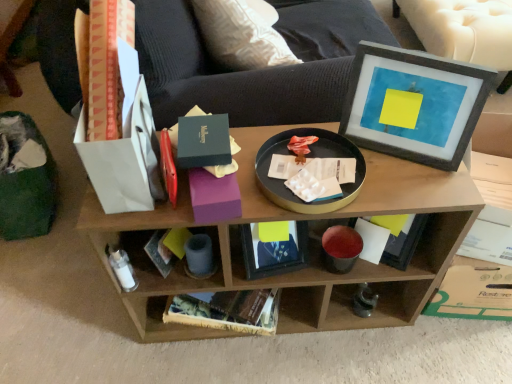
Question: Is matte gray picture frame at upper right to the left of white paper book at lower center from the viewer's perspective?

Choices:
 (A) yes
 (B) no

Answer: (B)

Question: Is matte gray picture frame at upper right positioned far away from white paper book at lower center?

Choices:
 (A) yes
 (B) no

Answer: (B)

Question: Is matte gray picture frame at upper right positioned in front of white paper book at lower center?

Choices:
 (A) no
 (B) yes

Answer: (B)

Question: Could you tell me if matte gray picture frame at upper right is facing white paper book at lower center?

Choices:
 (A) no
 (B) yes

Answer: (A)

Question: Is matte gray picture frame at upper right placed right next to white paper book at lower center?

Choices:
 (A) yes
 (B) no

Answer: (B)

Question: Can you confirm if matte gray picture frame at upper right is wider than white paper book at lower center?

Choices:
 (A) yes
 (B) no

Answer: (B)

Question: Does matte gray picture frame at upper right have a smaller size compared to wooden shelf at center?

Choices:
 (A) yes
 (B) no

Answer: (A)

Question: Is matte gray picture frame at upper right turned away from wooden shelf at center?

Choices:
 (A) yes
 (B) no

Answer: (B)

Question: Is matte gray picture frame at upper right located outside wooden shelf at center?

Choices:
 (A) yes
 (B) no

Answer: (A)

Question: From a real-world perspective, is matte gray picture frame at upper right physically below wooden shelf at center?

Choices:
 (A) no
 (B) yes

Answer: (A)

Question: Could you tell me if matte gray picture frame at upper right is turned towards wooden shelf at center?

Choices:
 (A) no
 (B) yes

Answer: (A)

Question: Is matte gray picture frame at upper right thinner than wooden shelf at center?

Choices:
 (A) no
 (B) yes

Answer: (B)

Question: From a real-world perspective, is white paper book at lower center physically below wooden shelf at center?

Choices:
 (A) yes
 (B) no

Answer: (B)